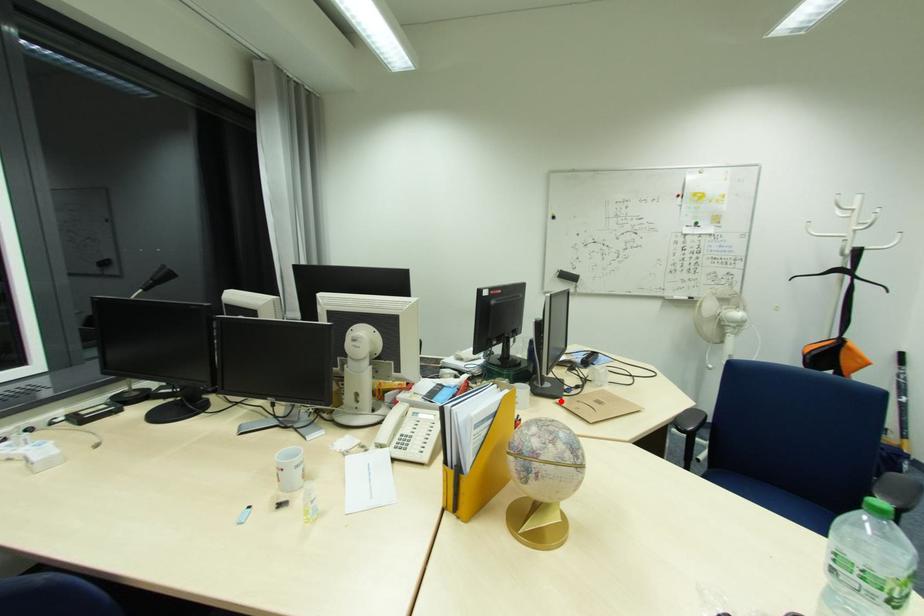
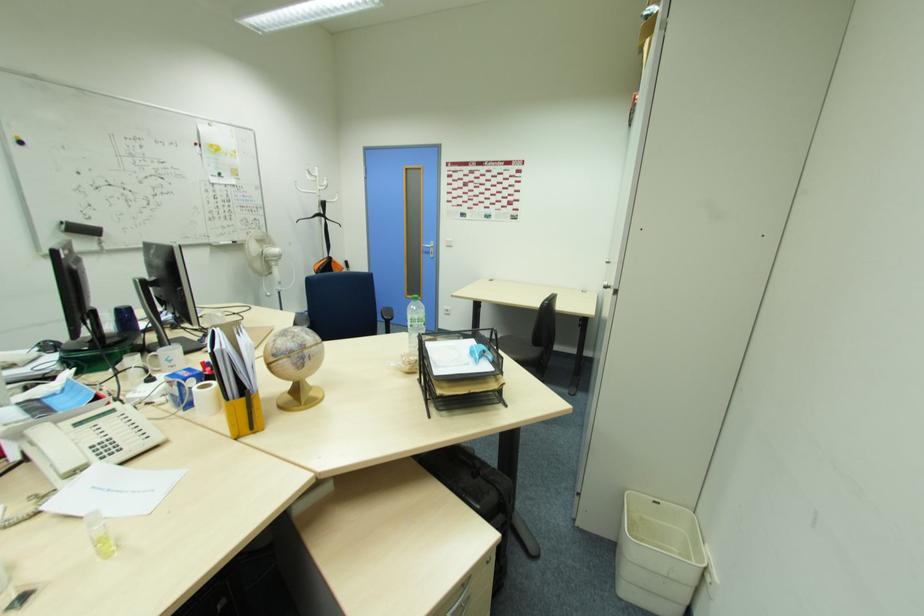
Question: A red point is marked in image1. In image2, is the corresponding 3D point closer to the camera or farther? Reply with the corresponding letter.

Choices:
 (A) The corresponding 3D point is closer.
 (B) The corresponding 3D point is farther.

Answer: (B)